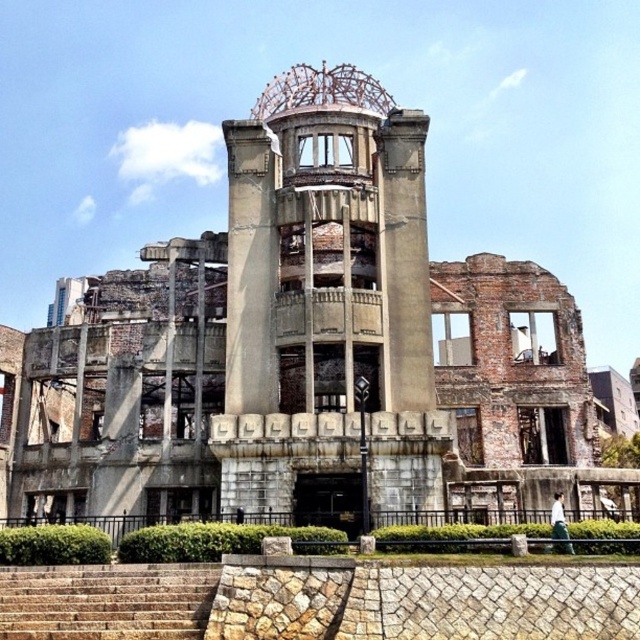
Is concrete/stone bell tower at center to the right of brown stone stairs at lower left from the viewer's perspective?

Indeed, concrete/stone bell tower at center is positioned on the right side of brown stone stairs at lower left.

Is concrete/stone bell tower at center below brown stone stairs at lower left?

No.

Who is more distant from viewer, (387, 230) or (76, 624)?

The point (387, 230) is more distant.

Locate an element on the screen. This screenshot has width=640, height=640. concrete/stone bell tower at center is located at coordinates (326, 301).

At what (x,y) coordinates should I click in order to perform the action: click on concrete/stone bell tower at center. Please return your answer as a coordinate pair (x, y). Looking at the image, I should click on (326, 301).

Between concrete/stone bell tower at center and concrete/rough column at center, which one appears on the right side from the viewer's perspective?

concrete/stone bell tower at center is more to the right.

Which is behind, point (340, 104) or point (244, 403)?

The point (340, 104) is more distant.

Locate an element on the screen. concrete/stone bell tower at center is located at coordinates (326, 301).

Is brown stone stairs at lower left above concrete/rough column at center?

No, brown stone stairs at lower left is not above concrete/rough column at center.

Where is `brown stone stairs at lower left`? brown stone stairs at lower left is located at coordinates (106, 602).